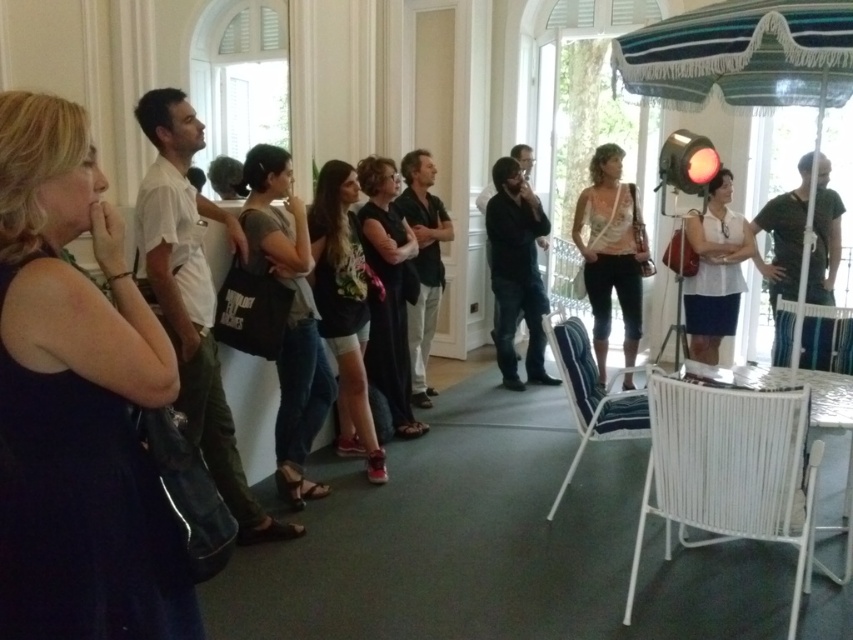
You are standing in the room and see the point marked at coordinates (610, 252). What object is located at that point?

The point at coordinates (610, 252) corresponds to the light beige fabric purse at center.

You are standing in the room and want to place a new decorative item exactly where the light beige fabric purse at center is located. What are the coordinates for placing the item?

The coordinates for placing the item would be at point [610,252], where the light beige fabric purse at center is located.